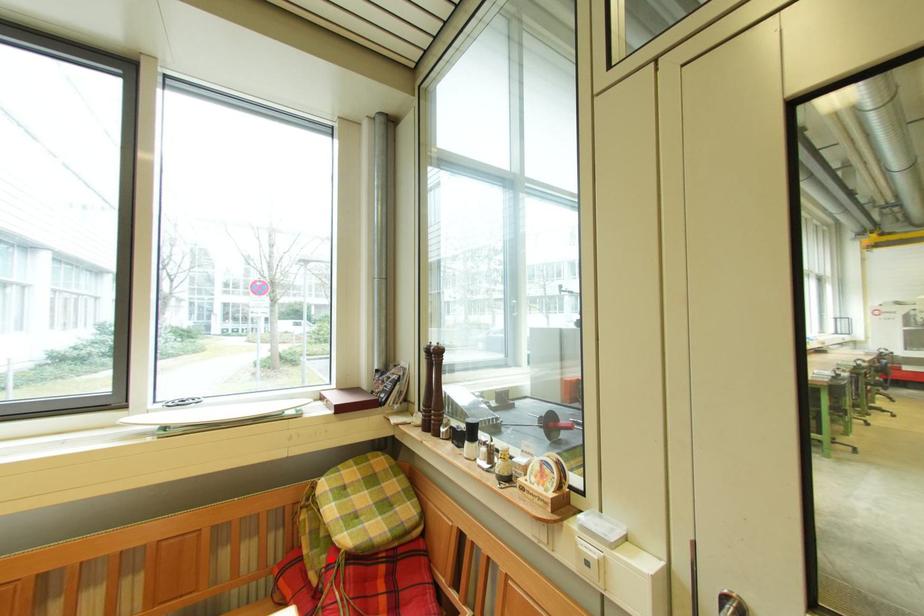
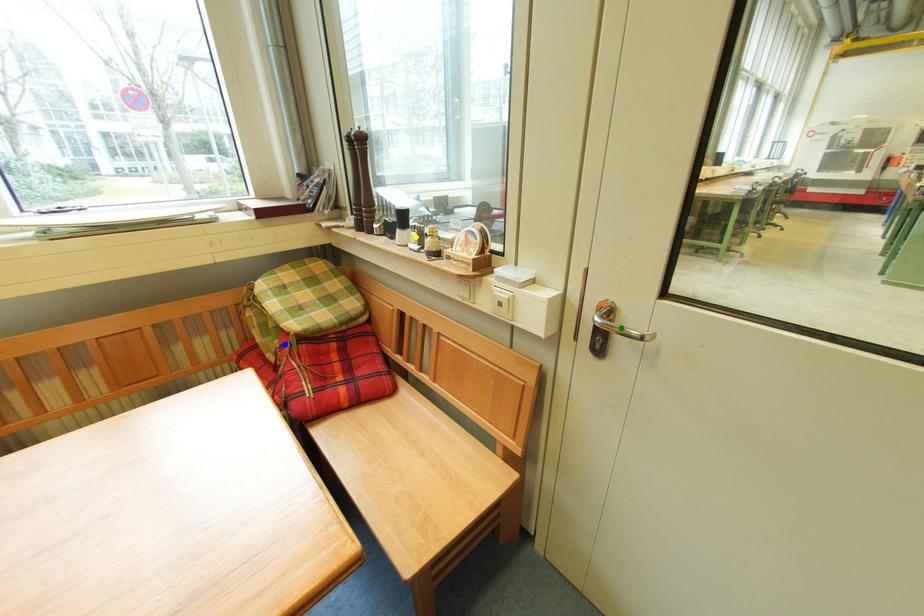
Question: I am providing you with two images of the same scene from different viewpoints. A red point is marked on the first image. You are given multiple points on the second image. Which point in image 2 represents the same 3d spot as the red point in image 1?

Choices:
 (A) blue point
 (B) green point
 (C) yellow point

Answer: (A)